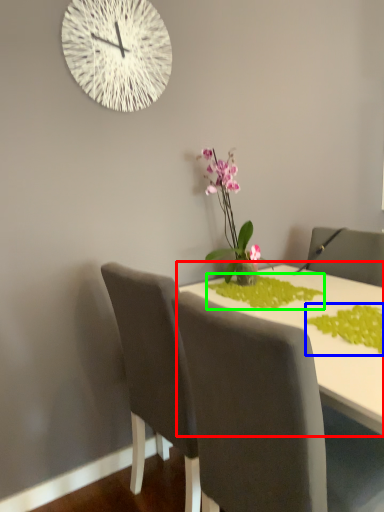
Question: Which object is positioned farthest from table (highlighted by a red box)? Select from plant (highlighted by a blue box) and plant (highlighted by a green box).

Choices:
 (A) plant
 (B) plant

Answer: (A)